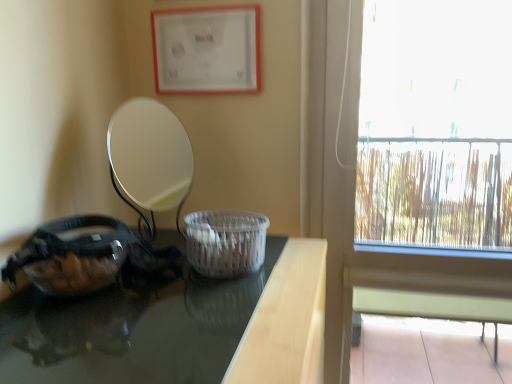
You are a GUI agent. You are given a task and a screenshot of the screen. Output one action in this format:
    pyautogui.click(x=<x>, y=<y>)
    Task: Click on the free location to the right of white woven basket at center
    This screenshot has width=512, height=384.
    Given the screenshot: What is the action you would take?
    pyautogui.click(x=294, y=263)